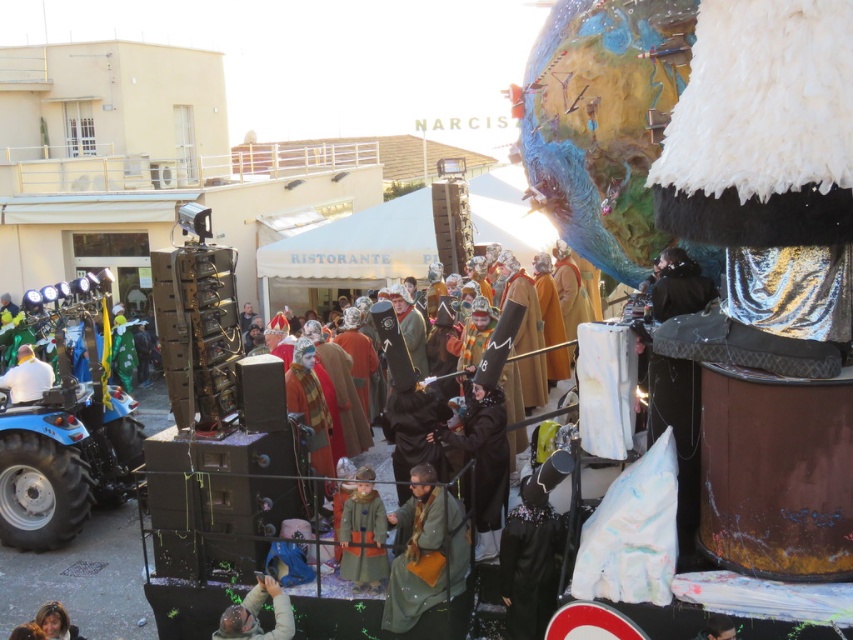
Question: Which of the following is the farthest from the observer?

Choices:
 (A) green matte coat at center
 (B) white matte shirt at lower left

Answer: (B)

Question: Which object is farther from the camera taking this photo?

Choices:
 (A) matte black helmet at lower center
 (B) smooth brown hair at lower left
 (C) green wool coat at center
 (D) green matte coat at center

Answer: (C)

Question: Can you confirm if green matte coat at center is smaller than matte black helmet at lower center?

Choices:
 (A) yes
 (B) no

Answer: (B)

Question: Is green matte coat at center above matte black helmet at lower center?

Choices:
 (A) yes
 (B) no

Answer: (A)

Question: Among these objects, which one is nearest to the camera?

Choices:
 (A) green matte coat at center
 (B) matte black helmet at lower center
 (C) white matte shirt at lower left

Answer: (B)

Question: Does green matte coat at center appear on the left side of matte black helmet at lower center?

Choices:
 (A) yes
 (B) no

Answer: (B)